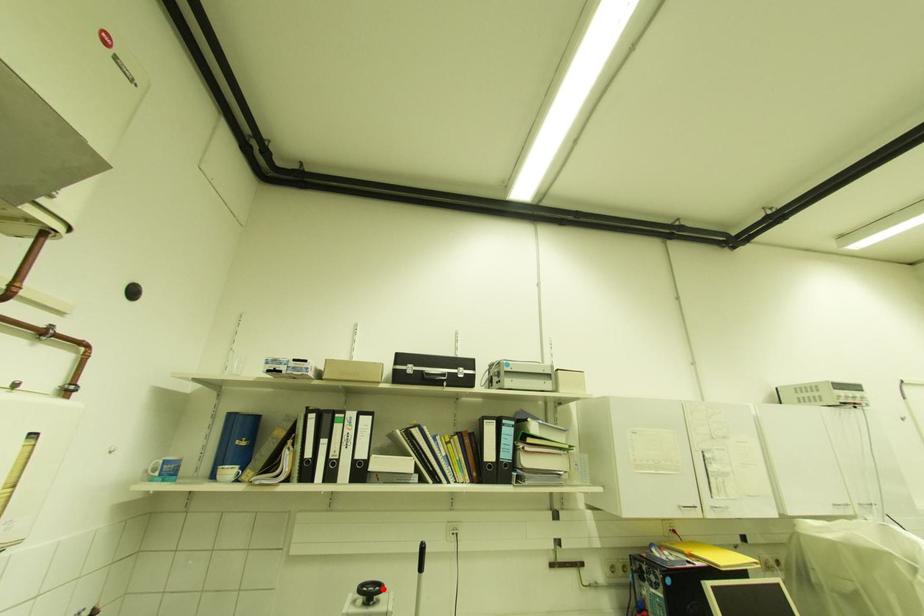
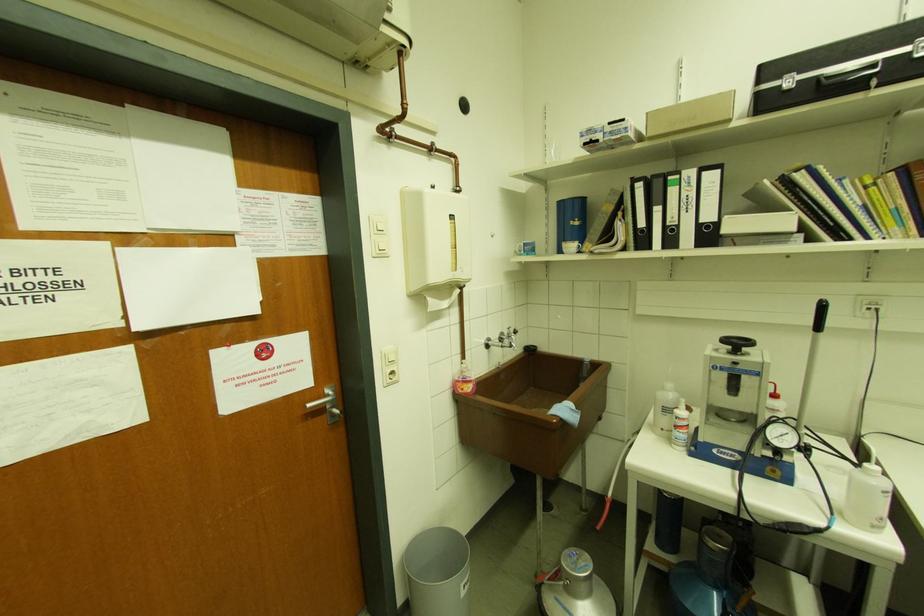
The point at the highlighted location is marked in the first image. Where is the corresponding point in the second image?

(752, 344)